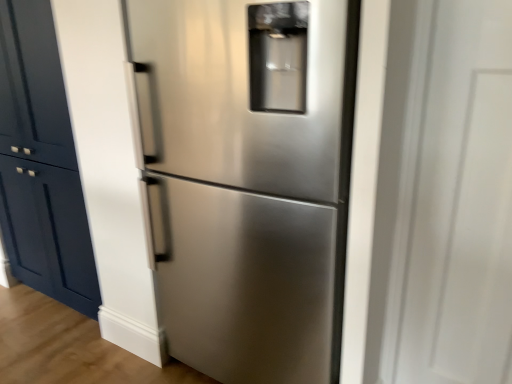
In order to face transparent glass door at right, should I rotate leftwards or rightwards?

It's best to rotate right around 28.799 degrees.

Describe the element at coordinates (41, 163) in the screenshot. I see `matte navy blue cabinet at left` at that location.

Locate an element on the screen. stainless steel refrigerator at center is located at coordinates (248, 179).

Which of these two, transparent glass door at right or matte navy blue cabinet at left, is bigger?

With larger size is matte navy blue cabinet at left.

Is transparent glass door at right placed right next to matte navy blue cabinet at left?

transparent glass door at right and matte navy blue cabinet at left are not in contact.

Does transparent glass door at right lie in front of matte navy blue cabinet at left?

Yes, transparent glass door at right is closer to the viewer.

Is transparent glass door at right oriented towards matte navy blue cabinet at left?

No, transparent glass door at right is not aimed at matte navy blue cabinet at left.

Is point (283, 370) closer to camera compared to point (41, 183)?

Yes.

Does stainless steel refrigerator at center turn towards matte navy blue cabinet at left?

No, stainless steel refrigerator at center is not aimed at matte navy blue cabinet at left.

Which is in front, stainless steel refrigerator at center or matte navy blue cabinet at left?

stainless steel refrigerator at center is closer to the camera.

From the picture: Is matte navy blue cabinet at left facing away from stainless steel refrigerator at center?

That's not correct — matte navy blue cabinet at left is not looking away from stainless steel refrigerator at center.

In the scene shown: From a real-world perspective, between matte navy blue cabinet at left and stainless steel refrigerator at center, who is vertically lower?

From a 3D spatial view, stainless steel refrigerator at center is below.

Is matte navy blue cabinet at left taller or shorter than stainless steel refrigerator at center?

matte navy blue cabinet at left is taller than stainless steel refrigerator at center.

Which object is positioned more to the left, matte navy blue cabinet at left or stainless steel refrigerator at center?

matte navy blue cabinet at left.

Does transparent glass door at right come in front of stainless steel refrigerator at center?

Yes, transparent glass door at right is closer to the camera.

Which of these two, transparent glass door at right or stainless steel refrigerator at center, stands taller?

Standing taller between the two is stainless steel refrigerator at center.

Is transparent glass door at right positioned with its back to stainless steel refrigerator at center?

No, transparent glass door at right is not facing away from stainless steel refrigerator at center.

From the image's perspective, is transparent glass door at right located beneath stainless steel refrigerator at center?

Yes.

Is there a large distance between matte navy blue cabinet at left and transparent glass door at right?

Yes.

Is matte navy blue cabinet at left facing away from transparent glass door at right?

That's not correct — matte navy blue cabinet at left is not looking away from transparent glass door at right.

From a real-world perspective, is matte navy blue cabinet at left beneath transparent glass door at right?

Correct, in the physical world, matte navy blue cabinet at left is lower than transparent glass door at right.

Where is `glass door on the right of the matte navy blue cabinet at left`? The width and height of the screenshot is (512, 384). glass door on the right of the matte navy blue cabinet at left is located at coordinates (444, 198).

How different are the orientations of stainless steel refrigerator at center and transparent glass door at right in degrees?

The facing directions of stainless steel refrigerator at center and transparent glass door at right are 0.883 degrees apart.

Is point (222, 1) closer or farther from the camera than point (510, 200)?

Point (222, 1) is closer to the camera than point (510, 200).

Does stainless steel refrigerator at center turn towards transparent glass door at right?

No, stainless steel refrigerator at center is not turned towards transparent glass door at right.

Would you say stainless steel refrigerator at center is a long distance from transparent glass door at right?

No.

Identify the location of door located behind the transparent glass door at right. (41, 163).

This screenshot has width=512, height=384. I want to click on refrigerator directly beneath the matte navy blue cabinet at left (from a real-world perspective), so click(x=248, y=179).

Considering their positions, is stainless steel refrigerator at center positioned further to transparent glass door at right than matte navy blue cabinet at left?

matte navy blue cabinet at left is positioned further to the anchor transparent glass door at right.

When comparing their distances from transparent glass door at right, does matte navy blue cabinet at left or stainless steel refrigerator at center seem closer?

stainless steel refrigerator at center is positioned closer to the anchor transparent glass door at right.

Looking at the image, which one is located closer to stainless steel refrigerator at center, transparent glass door at right or matte navy blue cabinet at left?

transparent glass door at right lies closer to stainless steel refrigerator at center than the other object.

Based on their spatial positions, is matte navy blue cabinet at left or transparent glass door at right further from stainless steel refrigerator at center?

matte navy blue cabinet at left is positioned further to the anchor stainless steel refrigerator at center.

Which object lies nearer to the anchor point matte navy blue cabinet at left, transparent glass door at right or stainless steel refrigerator at center?

Among the two, stainless steel refrigerator at center is located nearer to matte navy blue cabinet at left.

From the image, which object appears to be nearer to matte navy blue cabinet at left, stainless steel refrigerator at center or transparent glass door at right?

stainless steel refrigerator at center is closer to matte navy blue cabinet at left.

You are a GUI agent. You are given a task and a screenshot of the screen. Output one action in this format:
    pyautogui.click(x=<x>, y=<y>)
    Task: Click on the refrigerator located between matte navy blue cabinet at left and transparent glass door at right in the left-right direction
    This screenshot has width=512, height=384.
    Given the screenshot: What is the action you would take?
    pyautogui.click(x=248, y=179)